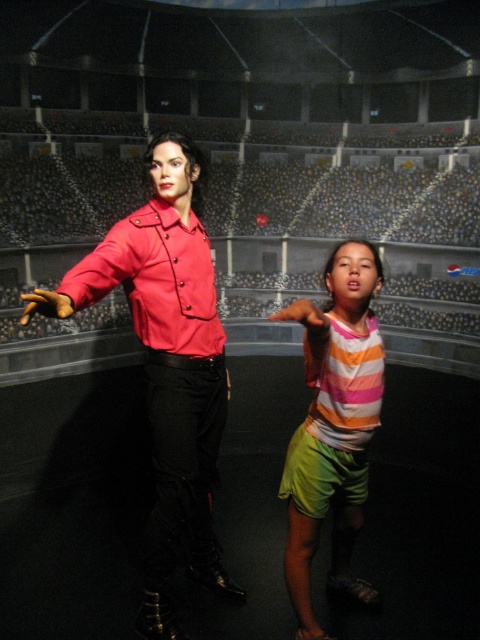
This screenshot has height=640, width=480. In order to click on matte red jacket at left in this screenshot , I will do `click(167, 364)`.

Which of these two, matte red jacket at left or striped cotton shirt at center, stands taller?

With more height is matte red jacket at left.

At what (x,y) coordinates should I click in order to perform the action: click on matte red jacket at left. Please return your answer as a coordinate pair (x, y). Looking at the image, I should click on (167, 364).